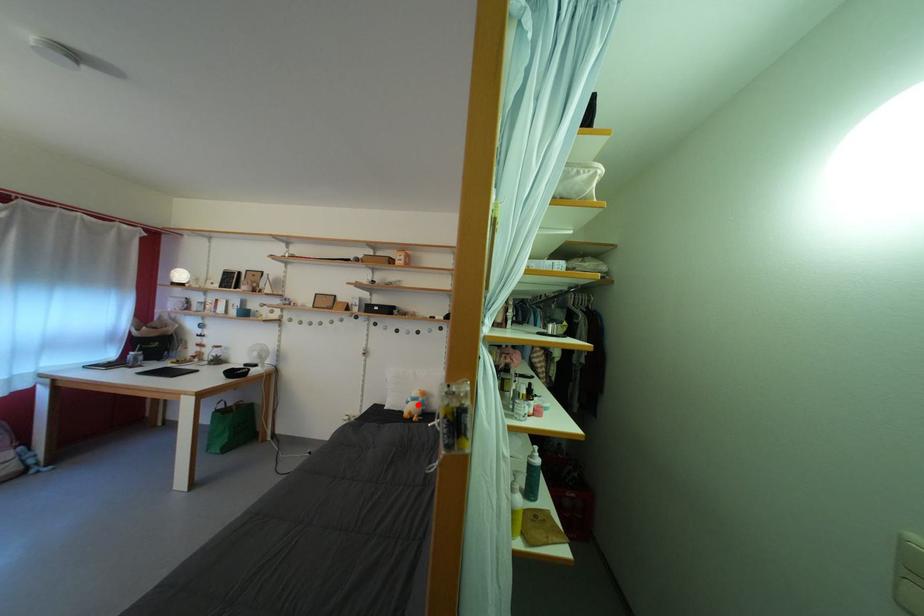
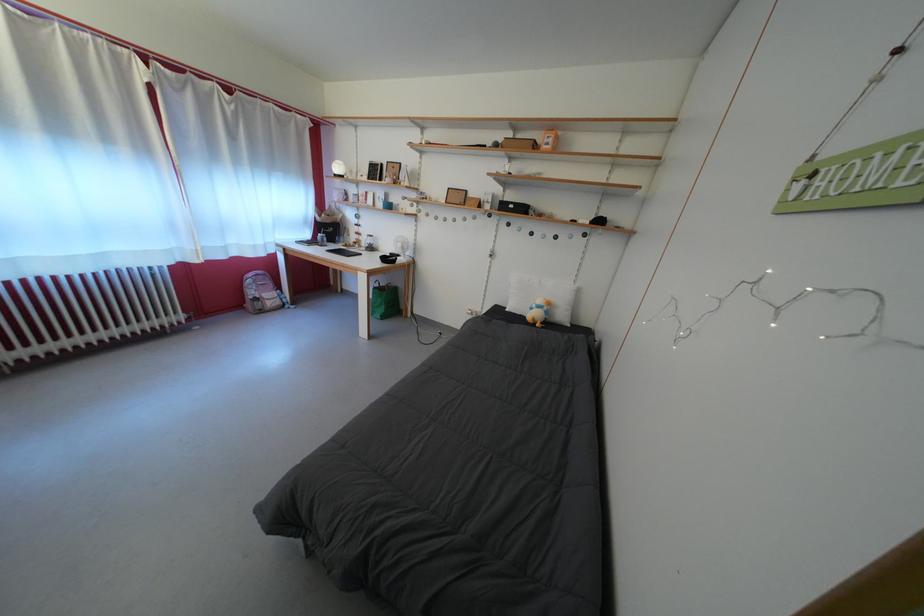
Where in the second image is the point corresponding to the highlighted location from the first image?

(542, 312)